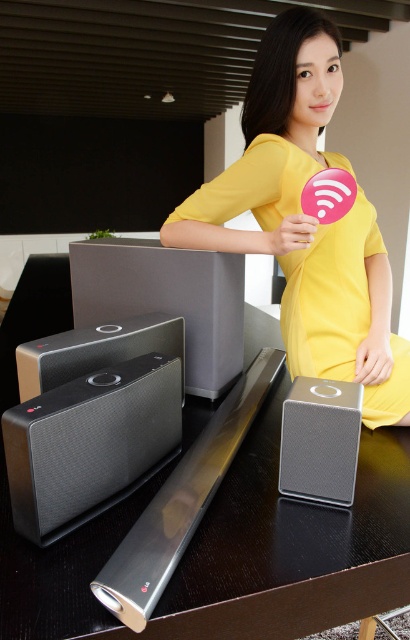
Who is more forward, (x=264, y=224) or (x=38, y=384)?

Point (x=38, y=384) is more forward.

Describe the element at coordinates (293, 252) in the screenshot. I see `yellow fabric dress at center` at that location.

In order to click on yellow fabric dress at center in this screenshot , I will do `click(293, 252)`.

Which of these two, yellow fabric dress at center or satin black speaker at center, stands shorter?

With less height is satin black speaker at center.

Is point (225, 234) positioned before point (305, 451)?

No, it is not.

I want to click on yellow fabric dress at center, so point(293,252).

From the picture: Does yellow fabric dress at center have a smaller size compared to matte black speaker at center?

No.

Between point (239, 234) and point (95, 324), which one is positioned in front?

Point (95, 324) is in front.

What do you see at coordinates (293, 252) in the screenshot? The height and width of the screenshot is (640, 410). I see `yellow fabric dress at center` at bounding box center [293, 252].

At what (x,y) coordinates should I click in order to perform the action: click on yellow fabric dress at center. Please return your answer as a coordinate pair (x, y). The image size is (410, 640). Looking at the image, I should click on (293, 252).